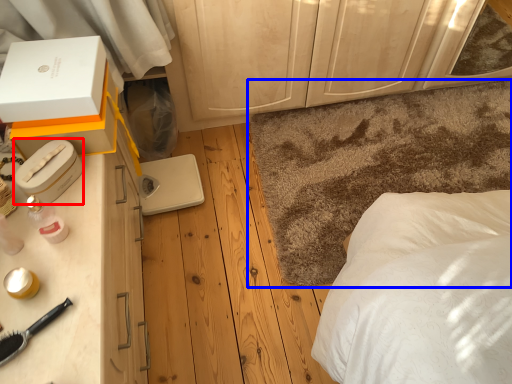
Question: Which object appears closest to the camera in this image, box (highlighted by a red box) or mat (highlighted by a blue box)?

Choices:
 (A) box
 (B) mat

Answer: (A)